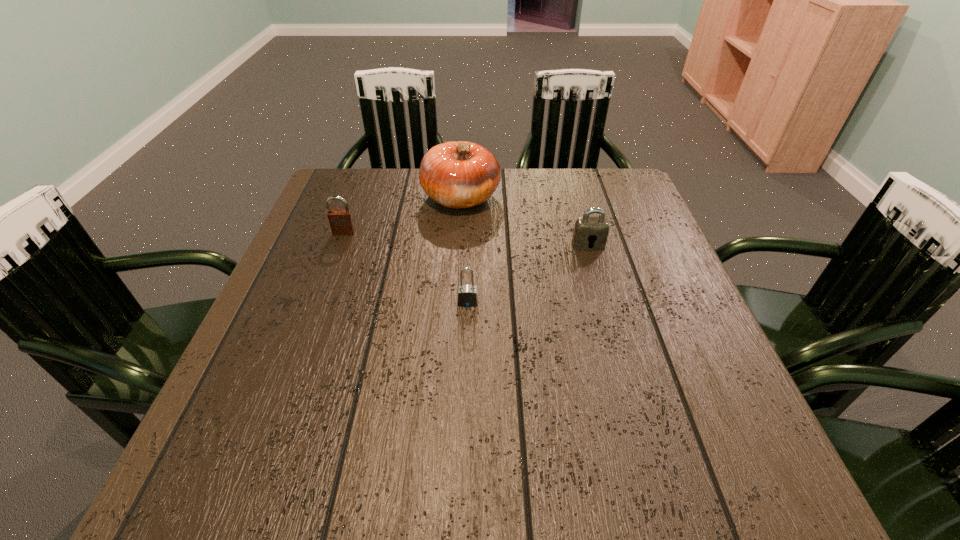
This screenshot has width=960, height=540. Find the location of `vacant region located 0.380m on the front-facing side of the farthest padlock`. vacant region located 0.380m on the front-facing side of the farthest padlock is located at coordinates (298, 359).

At what (x,y) coordinates should I click in order to perform the action: click on free space located on the shackle of the nearest object. Please return your answer as a coordinate pair (x, y). This screenshot has height=540, width=960. Looking at the image, I should click on (467, 337).

This screenshot has width=960, height=540. In order to click on object located at the far edge in this screenshot , I will do `click(459, 174)`.

The width and height of the screenshot is (960, 540). In order to click on object at the left edge in this screenshot , I will do `click(341, 222)`.

Identify the location of object present at the right edge. (590, 233).

You are a GUI agent. You are given a task and a screenshot of the screen. Output one action in this format:
    pyautogui.click(x=<x>, y=<y>)
    Task: Click on the free spot at the far edge of the desktop
    Image resolution: width=960 pixels, height=540 pixels.
    Given the screenshot: What is the action you would take?
    pyautogui.click(x=401, y=185)

Locate an element on the screen. The width and height of the screenshot is (960, 540). vacant space at the near edge is located at coordinates (511, 444).

Image resolution: width=960 pixels, height=540 pixels. I want to click on vacant space at the left edge of the desktop, so click(324, 350).

In the image, there is a desktop. Identify the location of blank space at the right edge. Image resolution: width=960 pixels, height=540 pixels. (673, 298).

Where is `vacant space at the far left corner of the desktop`? The width and height of the screenshot is (960, 540). vacant space at the far left corner of the desktop is located at coordinates (370, 183).